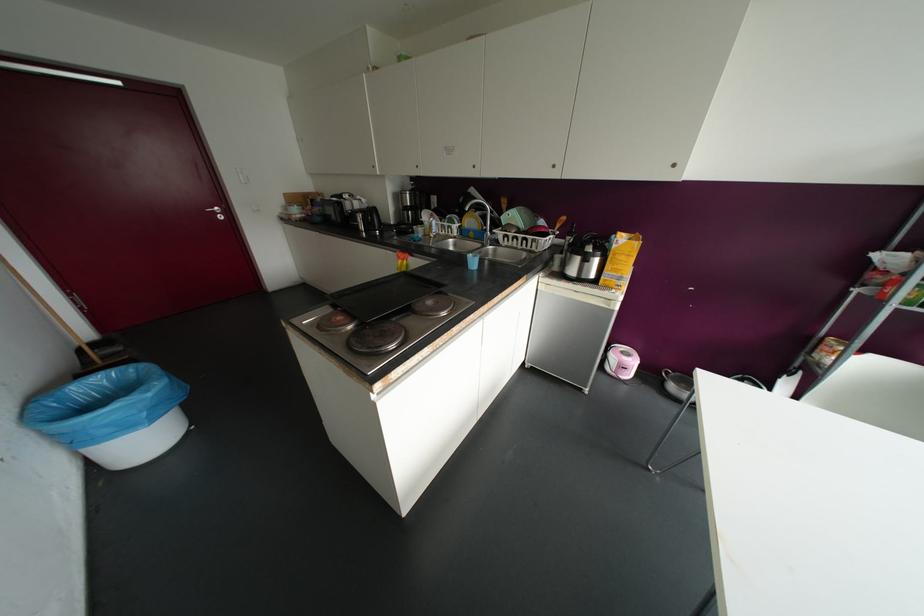
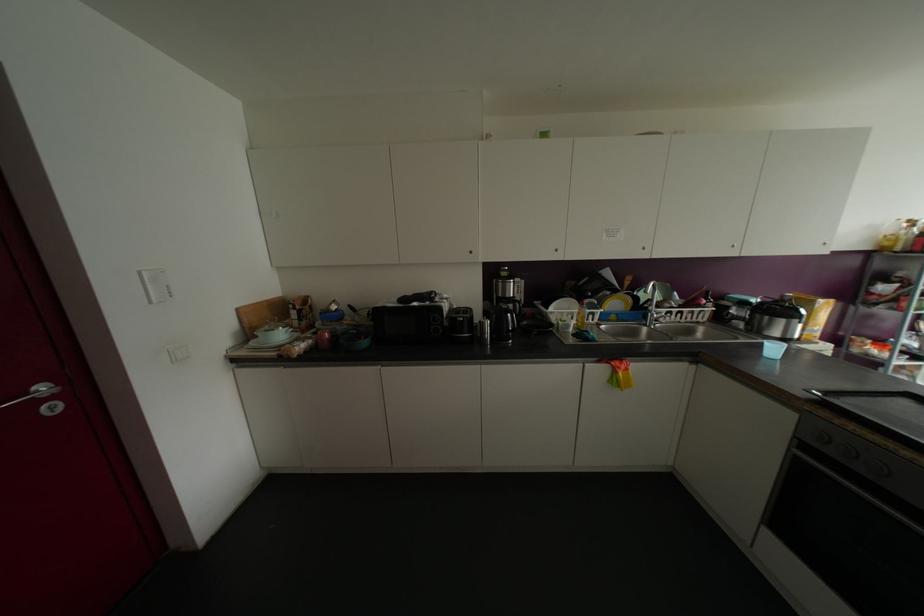
Locate, in the second image, the point that corresponds to (x=319, y=219) in the first image.

(363, 342)